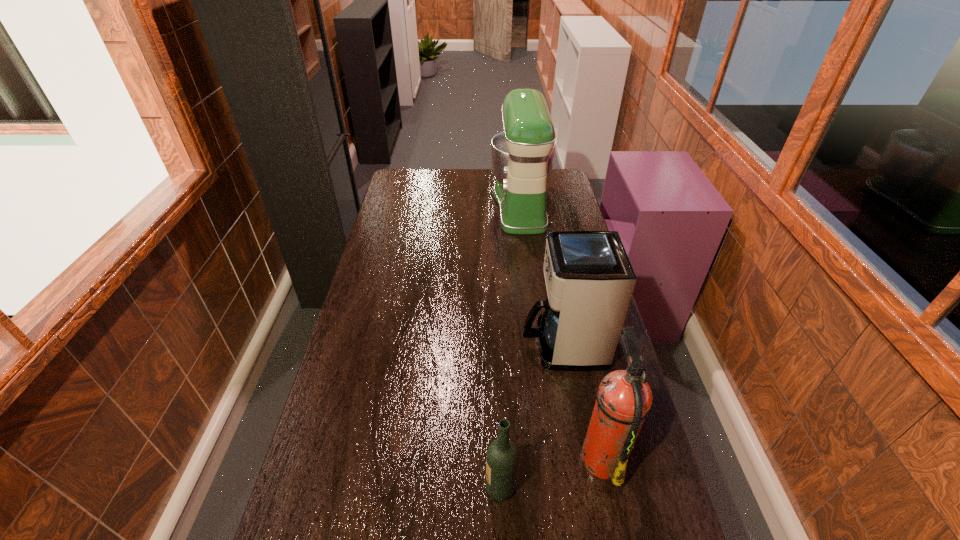
Image resolution: width=960 pixels, height=540 pixels. What are the coordinates of `free space between the coffee maker and the farthest object` in the screenshot? It's located at (541, 275).

At what (x,y) coordinates should I click in order to perform the action: click on vacant area between the fire extinguisher and the shortest object. Please return your answer as a coordinate pair (x, y). This screenshot has width=960, height=540. Looking at the image, I should click on (551, 472).

Find the location of a particular element. The height and width of the screenshot is (540, 960). object that can be found as the closest to the coffee maker is located at coordinates (624, 398).

In order to click on object that is the second closest to the fire extinguisher in this screenshot , I will do `click(502, 456)`.